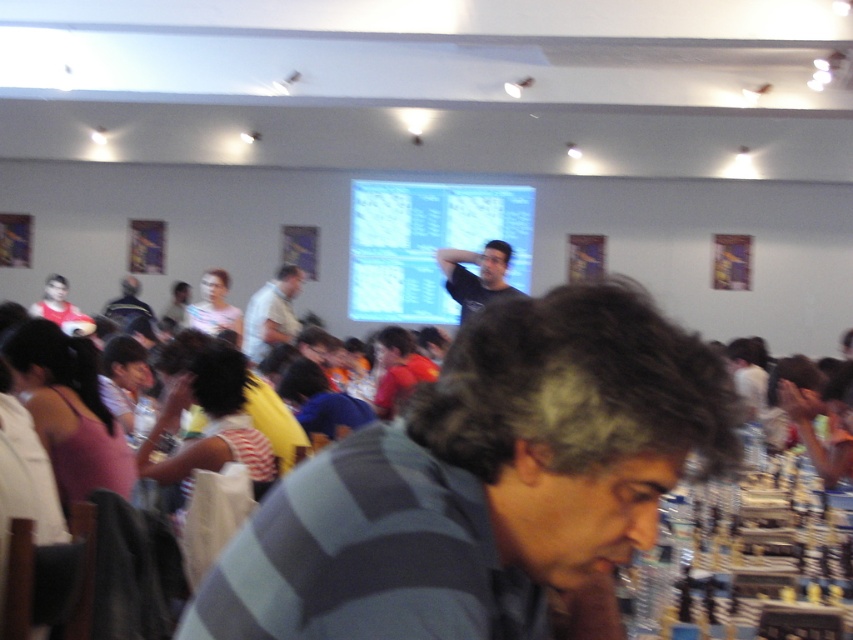
Question: Which of these objects is positioned farthest from the dark blue shirt at center?

Choices:
 (A) black matte shirt at center
 (B) matte plastic projection screen at center
 (C) light gray shirt at center
 (D) gray striped shirt at center

Answer: (D)

Question: Which of the following is the farthest from the observer?

Choices:
 (A) dark blue shirt at center
 (B) light gray shirt at center
 (C) black matte shirt at center
 (D) gray striped shirt at center

Answer: (A)

Question: Does gray striped shirt at center appear on the left side of matte plastic projection screen at center?

Choices:
 (A) yes
 (B) no

Answer: (B)

Question: Can you confirm if gray striped shirt at center is positioned above matte plastic projection screen at center?

Choices:
 (A) yes
 (B) no

Answer: (B)

Question: Can you confirm if matte plastic projection screen at center is smaller than dark blue shirt at center?

Choices:
 (A) no
 (B) yes

Answer: (A)

Question: Among these objects, which one is farthest from the camera?

Choices:
 (A) dark blue shirt at center
 (B) gray striped shirt at center
 (C) light gray shirt at center

Answer: (A)